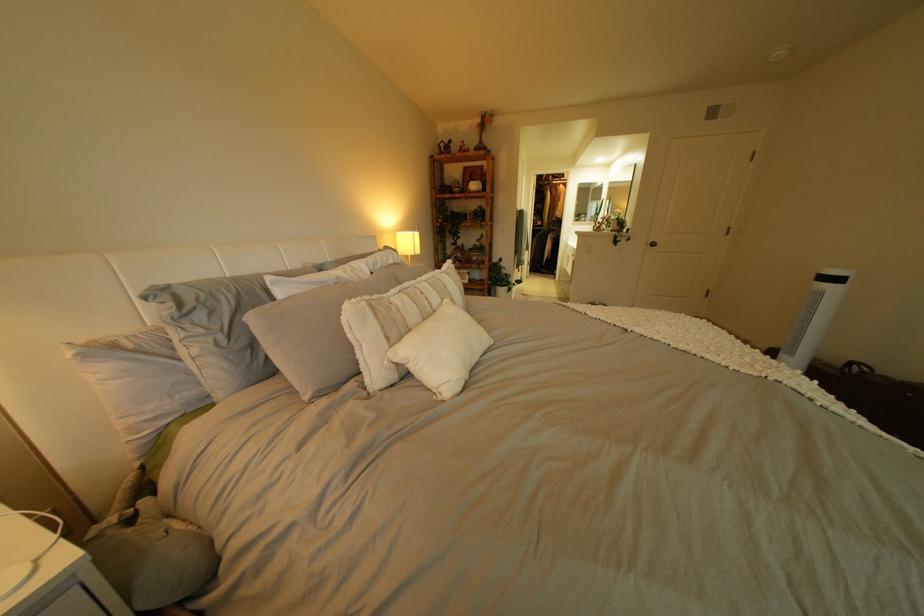
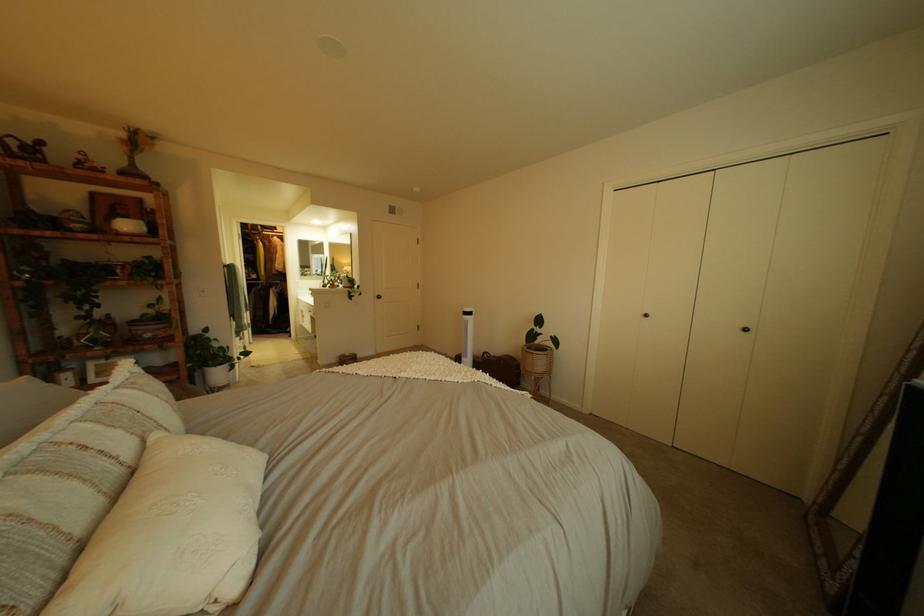
In the second image, find the point that corresponds to (x=832, y=383) in the first image.

(504, 376)